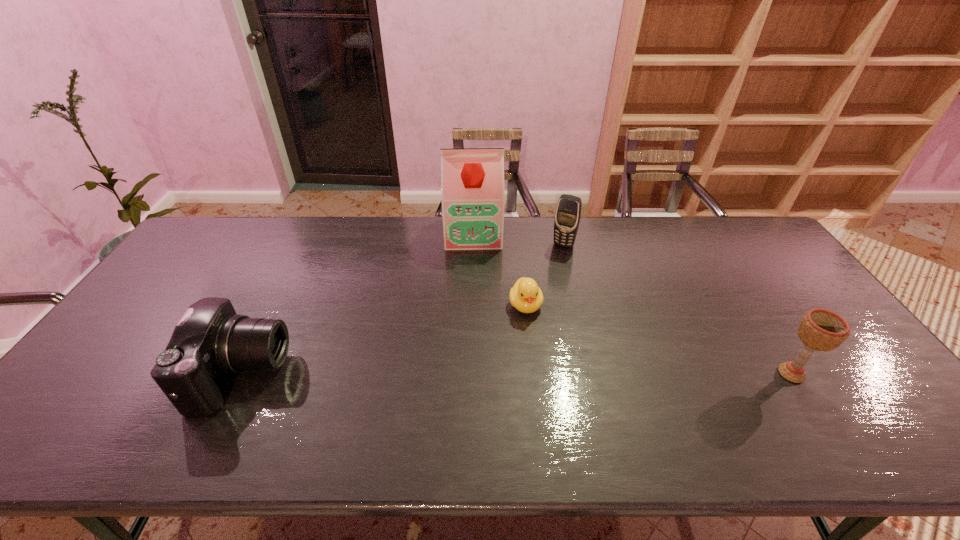
Where is `camera positioned at the near edge`? Image resolution: width=960 pixels, height=540 pixels. camera positioned at the near edge is located at coordinates (x=210, y=341).

Find the location of a particular element. The height and width of the screenshot is (540, 960). chalice at the near edge is located at coordinates (822, 330).

Image resolution: width=960 pixels, height=540 pixels. I want to click on vacant position at the far edge of the desktop, so click(x=625, y=217).

In the image, there is a desktop. What are the coordinates of `free space at the near edge` in the screenshot? It's located at (325, 393).

I want to click on free spot at the left edge of the desktop, so click(x=105, y=360).

In the image, there is a desktop. Where is `blank space at the right edge`? This screenshot has height=540, width=960. blank space at the right edge is located at coordinates (829, 373).

In the image, there is a desktop. Where is `vacant space at the far left corner`? The width and height of the screenshot is (960, 540). vacant space at the far left corner is located at coordinates (187, 253).

I want to click on vacant area at the far right corner, so click(776, 254).

I want to click on empty space that is in between the tallest object and the rightmost object, so click(632, 303).

You are a GUI agent. You are given a task and a screenshot of the screen. Output one action in this format:
    pyautogui.click(x=<x>, y=<y>)
    Task: Click on the vacant space that's between the fourth object from left to right and the tallest object
    This screenshot has width=960, height=540.
    Given the screenshot: What is the action you would take?
    pyautogui.click(x=518, y=239)